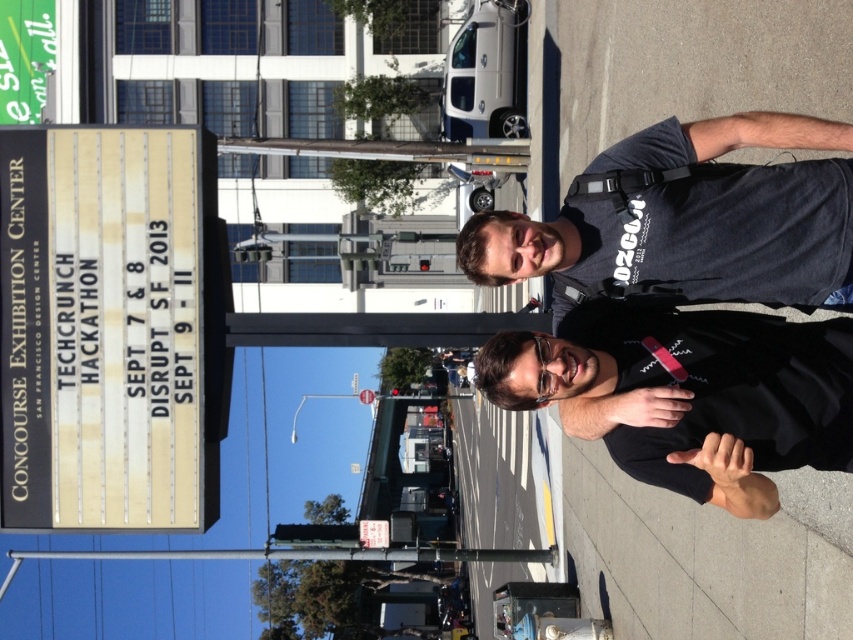
Is dark gray t-shirt at center wider than black matte shirt at center?

Yes.

Does dark gray t-shirt at center have a lesser width compared to black matte shirt at center?

No, dark gray t-shirt at center is not thinner than black matte shirt at center.

Find the location of a particular element. dark gray t-shirt at center is located at coordinates (688, 220).

The height and width of the screenshot is (640, 853). In order to click on dark gray t-shirt at center in this screenshot , I will do `click(688, 220)`.